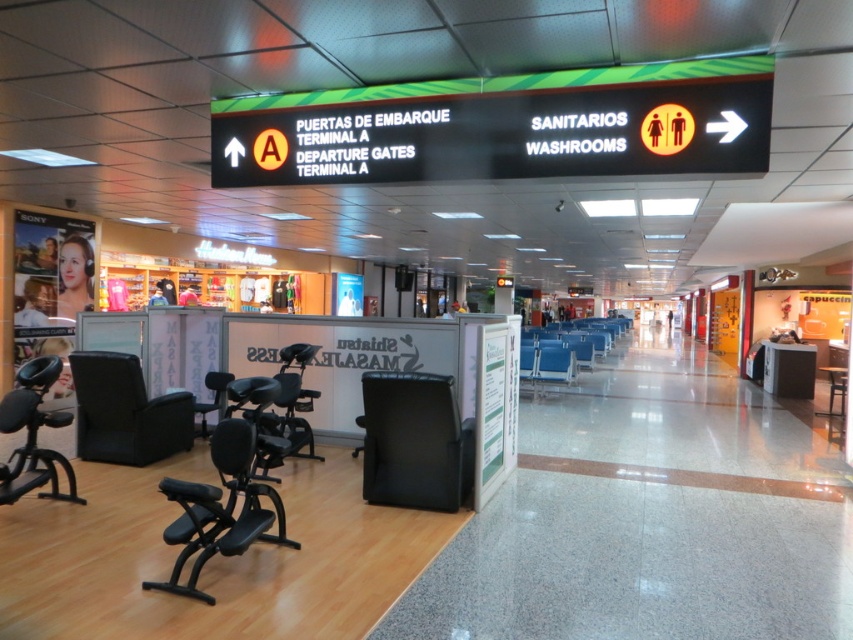
Measure the distance between point (21, 461) and camera.

The distance of point (21, 461) from camera is 15.45 feet.

Can you confirm if black matte exercise chair at lower left is shorter than blue plastic chair at center?

Yes, black matte exercise chair at lower left is shorter than blue plastic chair at center.

Find the location of a particular element. Image resolution: width=853 pixels, height=640 pixels. black matte exercise chair at lower left is located at coordinates (33, 435).

Does metallic blue exercise bike at center have a greater width compared to blue fabric chair at center?

Incorrect, metallic blue exercise bike at center's width does not surpass blue fabric chair at center's.

Is metallic blue exercise bike at center smaller than blue fabric chair at center?

Incorrect, metallic blue exercise bike at center is not smaller in size than blue fabric chair at center.

Where is `metallic blue exercise bike at center`? metallic blue exercise bike at center is located at coordinates (296, 397).

Find the location of a particular element. metallic blue exercise bike at center is located at coordinates (296, 397).

Which is behind, point (236, 522) or point (560, 362)?

Point (560, 362)

Between point (218, 468) and point (558, 360), which one is positioned behind?

Positioned behind is point (558, 360).

You are a GUI agent. You are given a task and a screenshot of the screen. Output one action in this format:
    pyautogui.click(x=<x>, y=<y>)
    Task: Click on the black matte swivel chair at lower left
    
    Given the screenshot: What is the action you would take?
    pyautogui.click(x=219, y=508)